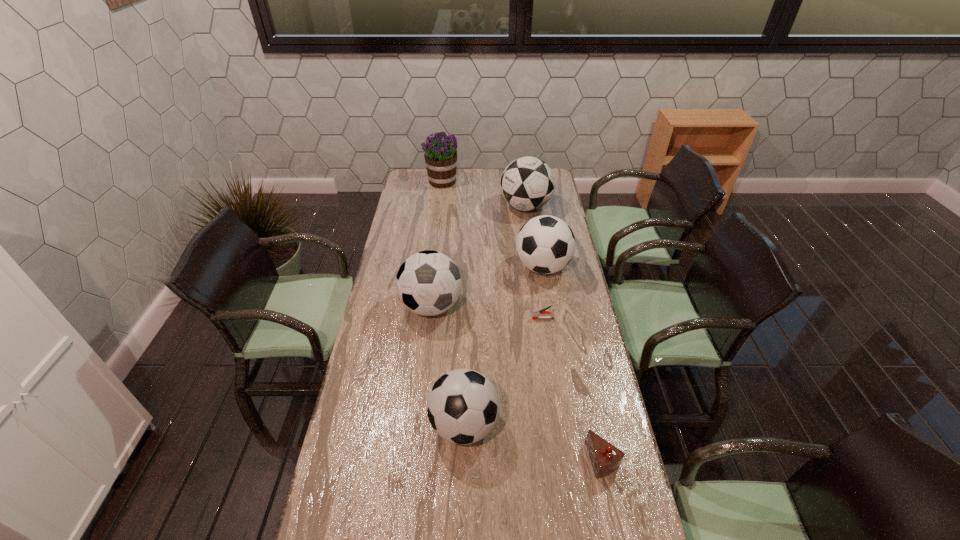
The image size is (960, 540). Identify the location of bouquet. (440, 155).

Locate an element on the screen. the sixth nearest object is located at coordinates (527, 183).

Locate an element on the screen. The height and width of the screenshot is (540, 960). the nearest soccer ball is located at coordinates (463, 405).

You are a GUI agent. You are given a task and a screenshot of the screen. Output one action in this format:
    pyautogui.click(x=<x>, y=<y>)
    Task: Click on the third shortest object
    The height and width of the screenshot is (540, 960).
    Given the screenshot: What is the action you would take?
    [463, 405]

Find the location of `chocolate cake`. chocolate cake is located at coordinates (605, 458).

This screenshot has height=540, width=960. In order to click on the shortest object in this screenshot , I will do `click(536, 314)`.

Image resolution: width=960 pixels, height=540 pixels. What are the coordinates of `free spot located on the front of the bouquet` in the screenshot? It's located at (440, 197).

Where is `free location located on the surface of the sixth nearest object where the brand logo is visible`? free location located on the surface of the sixth nearest object where the brand logo is visible is located at coordinates (450, 207).

Where is `free location located on the surface of the sixth nearest object where the brand logo is visible`? This screenshot has height=540, width=960. free location located on the surface of the sixth nearest object where the brand logo is visible is located at coordinates (458, 207).

Where is `vacant space located on the surface of the sixth nearest object where the brand logo is visible`? The image size is (960, 540). vacant space located on the surface of the sixth nearest object where the brand logo is visible is located at coordinates (475, 207).